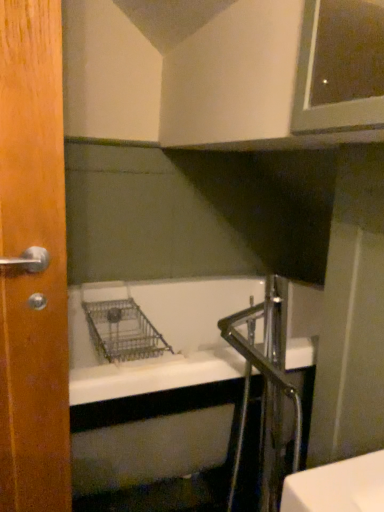
Question: Is wooden door at left at the right side of metallic silver faucet at lower right?

Choices:
 (A) no
 (B) yes

Answer: (A)

Question: Does wooden door at left have a lesser width compared to metallic silver faucet at lower right?

Choices:
 (A) no
 (B) yes

Answer: (B)

Question: Considering the relative sizes of wooden door at left and metallic silver faucet at lower right in the image provided, is wooden door at left taller than metallic silver faucet at lower right?

Choices:
 (A) yes
 (B) no

Answer: (A)

Question: Is wooden door at left closer to camera compared to metallic silver faucet at lower right?

Choices:
 (A) yes
 (B) no

Answer: (A)

Question: From a real-world perspective, is wooden door at left located beneath metallic silver faucet at lower right?

Choices:
 (A) no
 (B) yes

Answer: (A)

Question: Is wooden door at left positioned far away from metallic silver faucet at lower right?

Choices:
 (A) yes
 (B) no

Answer: (B)

Question: Does metallic silver faucet at lower right have a smaller size compared to wooden door at left?

Choices:
 (A) yes
 (B) no

Answer: (B)

Question: Is metallic silver faucet at lower right not near wooden door at left?

Choices:
 (A) yes
 (B) no

Answer: (B)

Question: Does metallic silver faucet at lower right have a lesser height compared to wooden door at left?

Choices:
 (A) yes
 (B) no

Answer: (A)

Question: Is metallic silver faucet at lower right positioned beyond the bounds of wooden door at left?

Choices:
 (A) no
 (B) yes

Answer: (B)

Question: Is metallic silver faucet at lower right at the right side of wooden door at left?

Choices:
 (A) no
 (B) yes

Answer: (B)

Question: From the image's perspective, is metallic silver faucet at lower right under wooden door at left?

Choices:
 (A) yes
 (B) no

Answer: (A)

Question: From the image's perspective, is metallic silver faucet at lower right above or below wooden door at left?

Choices:
 (A) below
 (B) above

Answer: (A)